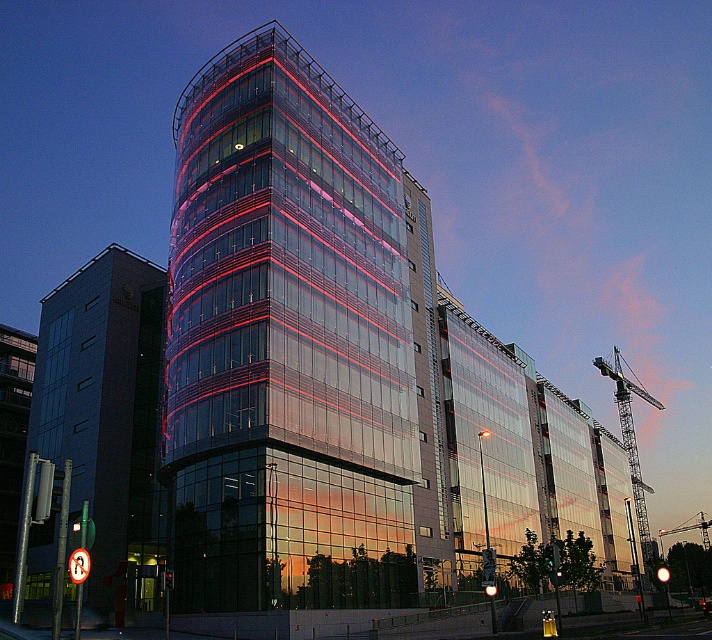
You are an architect evaluating the structural stability of the transparent glass building at center and the metallic gray crane at right. Based on their widths, which one might require additional reinforcement to withstand high winds?

The transparent glass building at center is thinner than the metallic gray crane at right, so it might require additional reinforcement to withstand high winds since it has a narrower structure.

You are an architect evaluating the feasibility of installing a new light fixture between the dark glass building at left and the metallic construction crane at right. Considering their heights, which object will the light fixture need to be positioned closer to?

The light fixture should be positioned closer to the metallic construction crane at right because the dark glass building at left is taller than the metallic construction crane at right, so the crane is shorter and the light can be placed nearer to it without obstruction.

You are an architect evaluating the building site. You need to determine if the metallic gray crane at right can reach the top of the transparent glass building at center. The crane has a maximum reach of 100 meters. Can it reach the top?

The transparent glass building at center has a greater height compared to the metallic gray crane at right. Since the crane can only reach 100 meters, if the building exceeds this height, the crane cannot reach the top. However, without specific height measurements, it is impossible to definitively answer.